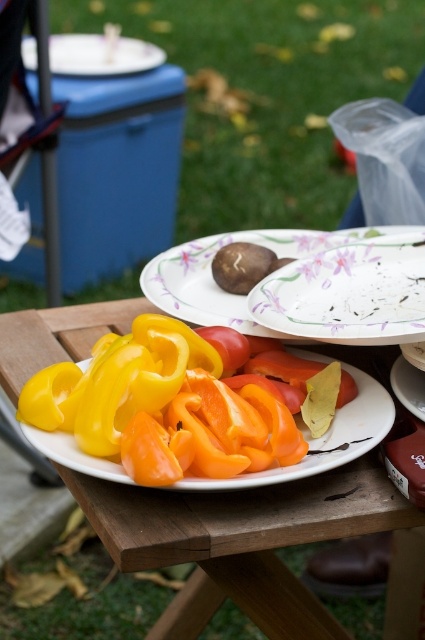
Is sliced yellow bell peppers at center thinner than brown matte mushroom at center?

No, sliced yellow bell peppers at center is not thinner than brown matte mushroom at center.

Who is more forward, (x=59, y=444) or (x=234, y=291)?

Point (x=59, y=444) is more forward.

The width and height of the screenshot is (425, 640). In order to click on sliced yellow bell peppers at center in this screenshot , I will do pos(323,440).

At what (x,y) coordinates should I click in order to perform the action: click on smooth plastic plate at center. Please return your answer as a coordinate pair (x, y). Looking at the image, I should click on (303, 284).

Is smooth plastic plate at center to the right of brown matte mushroom at center from the viewer's perspective?

Correct, you'll find smooth plastic plate at center to the right of brown matte mushroom at center.

This screenshot has width=425, height=640. Identify the location of smooth plastic plate at center. (303, 284).

Which is behind, point (282, 269) or point (22, 44)?

Positioned behind is point (22, 44).

What are the coordinates of `smooth plastic plate at center` in the screenshot? It's located at (303, 284).